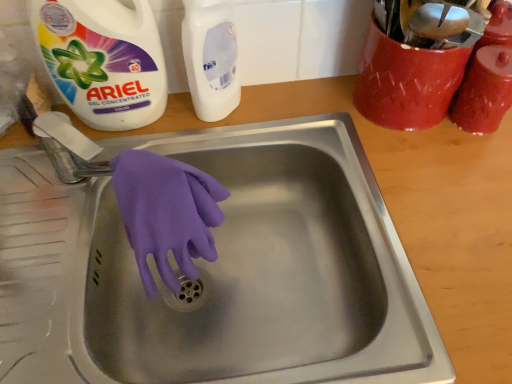
Question: Is white matte bottle at upper center, which ranks as the 2th cleaning product in right-to-left order, placed right next to white gel concentrated at upper left, which ranks as the 1th cleaning product in left-to-right order?

Choices:
 (A) yes
 (B) no

Answer: (B)

Question: Can you confirm if white matte bottle at upper center, acting as the 2th cleaning product starting from the left, is wider than white gel concentrated at upper left, placed as the 3th cleaning product when sorted from right to left?

Choices:
 (A) no
 (B) yes

Answer: (A)

Question: Is white matte bottle at upper center, acting as the 2th cleaning product starting from the left, shorter than white gel concentrated at upper left, which ranks as the 1th cleaning product in left-to-right order?

Choices:
 (A) yes
 (B) no

Answer: (A)

Question: From the image's perspective, would you say white matte bottle at upper center, acting as the 2th cleaning product starting from the left, is positioned over white gel concentrated at upper left, which ranks as the 1th cleaning product in left-to-right order?

Choices:
 (A) no
 (B) yes

Answer: (A)

Question: Considering the relative sizes of white matte bottle at upper center, which ranks as the 2th cleaning product in right-to-left order, and white gel concentrated at upper left, which ranks as the 1th cleaning product in left-to-right order, in the image provided, is white matte bottle at upper center, which ranks as the 2th cleaning product in right-to-left order, smaller than white gel concentrated at upper left, which ranks as the 1th cleaning product in left-to-right order,?

Choices:
 (A) yes
 (B) no

Answer: (A)

Question: Is the depth of white matte bottle at upper center, acting as the 2th cleaning product starting from the left, less than that of white gel concentrated at upper left, placed as the 3th cleaning product when sorted from right to left?

Choices:
 (A) no
 (B) yes

Answer: (A)

Question: Is matte red jar at upper right, the third cleaning product positioned from the left, surrounded by stainless steel sink at center?

Choices:
 (A) yes
 (B) no

Answer: (B)

Question: Considering the relative sizes of stainless steel sink at center and matte red jar at upper right, the third cleaning product positioned from the left, in the image provided, is stainless steel sink at center smaller than matte red jar at upper right, the third cleaning product positioned from the left,?

Choices:
 (A) no
 (B) yes

Answer: (A)

Question: Are stainless steel sink at center and matte red jar at upper right, the third cleaning product positioned from the left, far apart?

Choices:
 (A) yes
 (B) no

Answer: (B)

Question: Is stainless steel sink at center facing towards matte red jar at upper right, which is the 1th cleaning product from right to left?

Choices:
 (A) no
 (B) yes

Answer: (A)

Question: Considering the relative sizes of stainless steel sink at center and matte red jar at upper right, the third cleaning product positioned from the left, in the image provided, is stainless steel sink at center thinner than matte red jar at upper right, the third cleaning product positioned from the left,?

Choices:
 (A) no
 (B) yes

Answer: (A)

Question: From the image's perspective, is stainless steel sink at center on top of matte red jar at upper right, the third cleaning product positioned from the left?

Choices:
 (A) no
 (B) yes

Answer: (A)

Question: Is stainless steel sink at center to the right of white matte bottle at upper center, acting as the 2th cleaning product starting from the left, from the viewer's perspective?

Choices:
 (A) yes
 (B) no

Answer: (B)